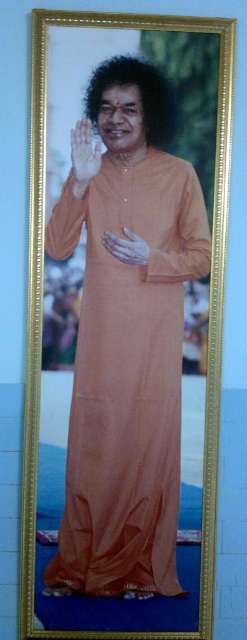
Between point (137, 61) and point (128, 236), which one is positioned behind?

Positioned behind is point (128, 236).

Describe the element at coordinates (139, 97) in the screenshot. The height and width of the screenshot is (640, 247). I see `curly hair at center` at that location.

I want to click on curly hair at center, so click(139, 97).

Is curly hair at center closer to the viewer compared to translucent skin hand at center?

Yes, curly hair at center is in front of translucent skin hand at center.

Is curly hair at center below translucent skin hand at center?

No, curly hair at center is not below translucent skin hand at center.

Who is more forward, (117, 84) or (75, 182)?

Point (117, 84) is more forward.

Find the location of `curly hair at center`. curly hair at center is located at coordinates (139, 97).

Who is more distant from viewer, (86, 184) or (104, 243)?

Point (104, 243)

Is point (76, 128) positioned after point (143, 257)?

No.

Where is `translucent skin hand at center`? The image size is (247, 640). translucent skin hand at center is located at coordinates (83, 154).